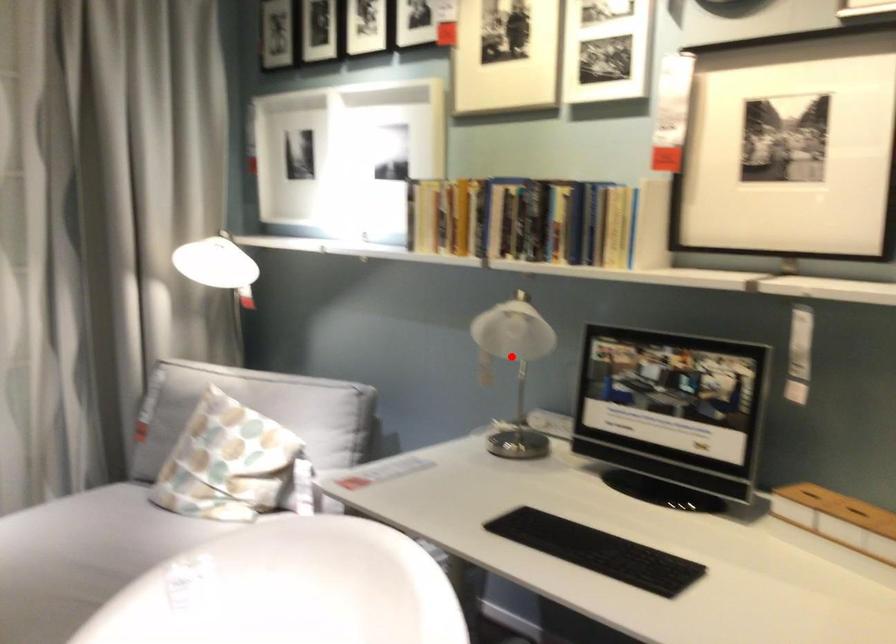
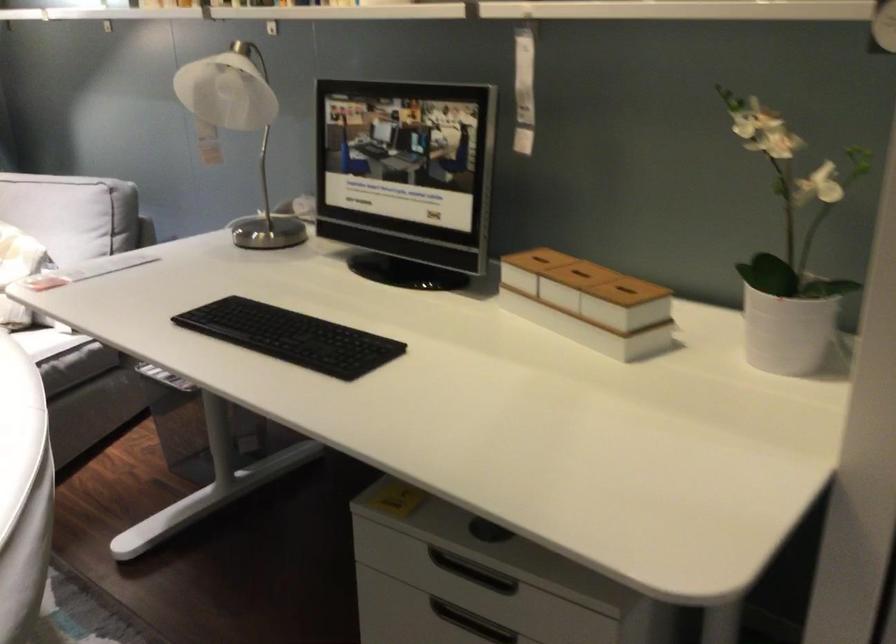
Locate, in the second image, the point that corresponds to the highlighted location in the first image.

(239, 128)